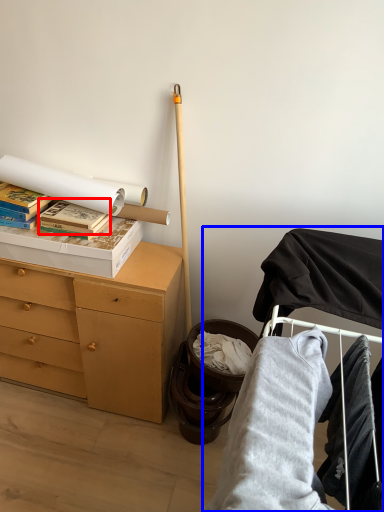
Question: Which object appears closest to the camera in this image, paperback book (highlighted by a red box) or bunk bed (highlighted by a blue box)?

Choices:
 (A) paperback book
 (B) bunk bed

Answer: (B)